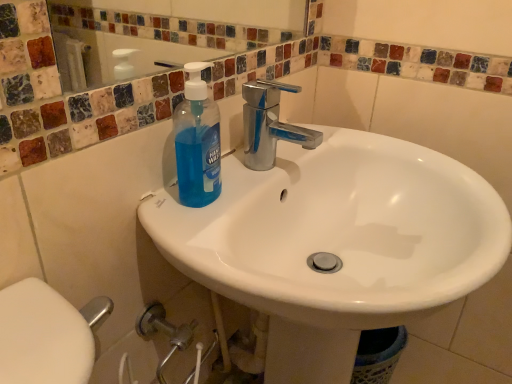
Question: Does blue translucent liquid soap at center have a greater height compared to white glossy sink at center?

Choices:
 (A) no
 (B) yes

Answer: (A)

Question: Can you confirm if blue translucent liquid soap at center is bigger than white glossy sink at center?

Choices:
 (A) yes
 (B) no

Answer: (B)

Question: Can you confirm if blue translucent liquid soap at center is positioned to the left of white glossy sink at center?

Choices:
 (A) yes
 (B) no

Answer: (A)

Question: Considering the relative sizes of blue translucent liquid soap at center and white glossy sink at center in the image provided, is blue translucent liquid soap at center shorter than white glossy sink at center?

Choices:
 (A) yes
 (B) no

Answer: (A)

Question: Can you confirm if blue translucent liquid soap at center is smaller than white glossy sink at center?

Choices:
 (A) yes
 (B) no

Answer: (A)

Question: Can we say blue translucent liquid soap at center lies outside white glossy sink at center?

Choices:
 (A) yes
 (B) no

Answer: (B)

Question: Does white glossy sink at center turn towards blue translucent liquid soap at center?

Choices:
 (A) yes
 (B) no

Answer: (B)

Question: Is white glossy sink at center positioned beyond the bounds of blue translucent liquid soap at center?

Choices:
 (A) yes
 (B) no

Answer: (A)

Question: Is the depth of white glossy sink at center less than that of blue translucent liquid soap at center?

Choices:
 (A) no
 (B) yes

Answer: (B)

Question: Is white glossy sink at center positioned behind blue translucent liquid soap at center?

Choices:
 (A) yes
 (B) no

Answer: (B)

Question: Would you say white glossy sink at center is a long distance from blue translucent liquid soap at center?

Choices:
 (A) yes
 (B) no

Answer: (B)

Question: Considering the relative sizes of white glossy sink at center and blue translucent liquid soap at center in the image provided, is white glossy sink at center thinner than blue translucent liquid soap at center?

Choices:
 (A) no
 (B) yes

Answer: (A)

Question: In the image, is blue translucent liquid soap at center positioned in front of or behind white glossy sink at center?

Choices:
 (A) behind
 (B) front

Answer: (A)